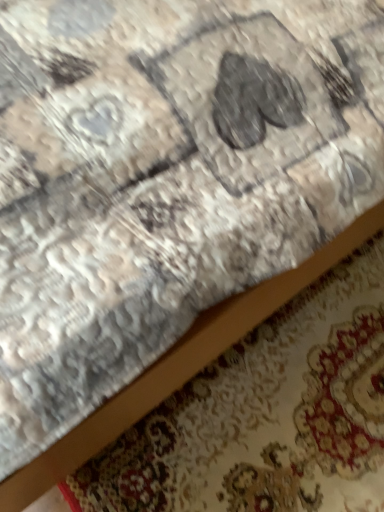
Identify the location of velvety beige mat at center. (264, 413).

The width and height of the screenshot is (384, 512). Describe the element at coordinates (264, 413) in the screenshot. I see `velvety beige mat at center` at that location.

In order to click on velvety beige mat at center in this screenshot , I will do `click(264, 413)`.